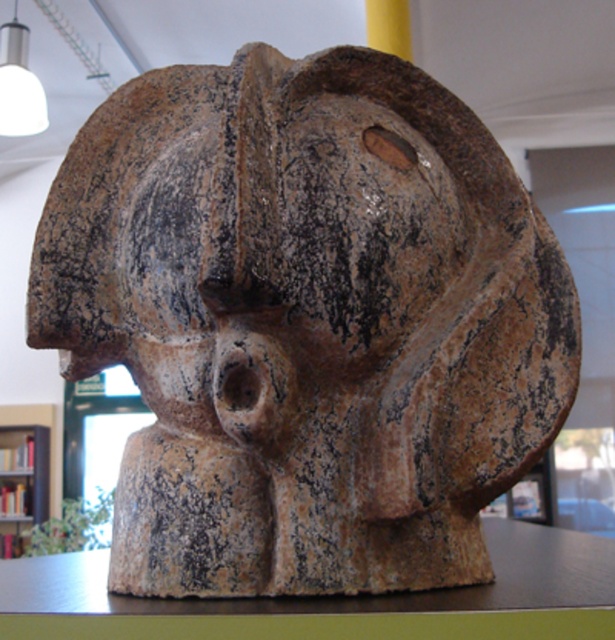
Is point (538, 529) in front of point (14, 472)?

Yes, point (538, 529) is in front of point (14, 472).

Is brown wood table at center smaller than wooden bookshelf at left?

Incorrect, brown wood table at center is not smaller in size than wooden bookshelf at left.

This screenshot has width=615, height=640. I want to click on brown wood table at center, so click(x=335, y=598).

Which is below, wooden bookshelf at left or matte white bulb at upper left?

wooden bookshelf at left is lower down.

Between point (20, 499) and point (1, 49), which one is positioned in front?

Positioned in front is point (1, 49).

You are a GUI agent. You are given a task and a screenshot of the screen. Output one action in this format:
    pyautogui.click(x=<x>, y=<y>)
    Task: Click on the wooden bookshelf at left
    
    Given the screenshot: What is the action you would take?
    pyautogui.click(x=25, y=472)

Identify the location of wooden bookshelf at left. (25, 472).

The width and height of the screenshot is (615, 640). What do you see at coordinates (335, 598) in the screenshot? I see `brown wood table at center` at bounding box center [335, 598].

Who is more forward, (341, 634) or (1, 125)?

Point (341, 634) is more forward.

I want to click on brown wood table at center, so click(335, 598).